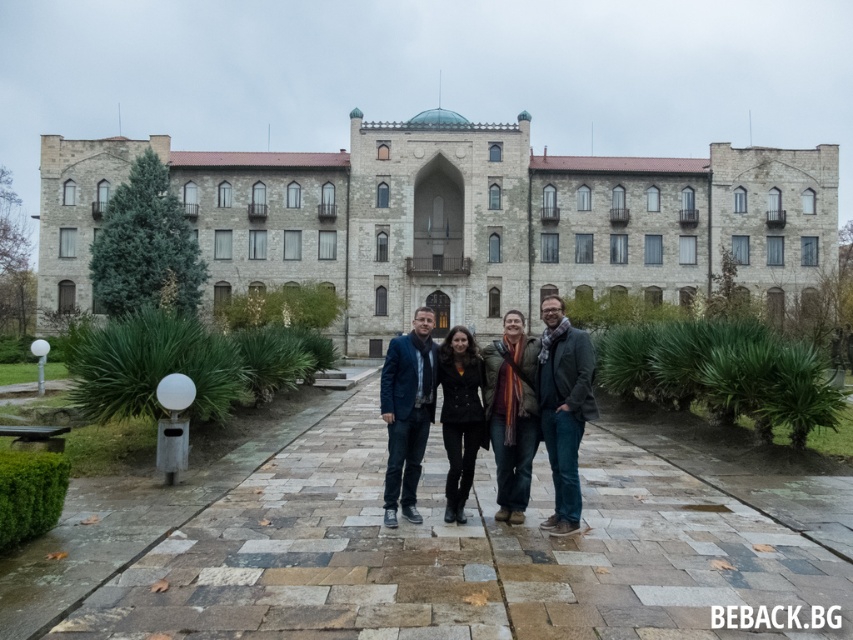
You are a fashion designer observing the group on the pathway in front of the historic building. You notice the dark gray wool scarf at center and the dark blue textured blazer at center. Which item of clothing is bigger in size?

The dark gray wool scarf at center is larger in size than the dark blue textured blazer at center.

You are a photographer trying to capture a photo of the group standing on the pathway in front of the historic building. You notice the dark gray wool scarf at center and the dark blue textured blazer at center. Which clothing item is positioned higher on the person wearing them?

The dark gray wool scarf at center is taller than the dark blue textured blazer at center, so the scarf is positioned higher on the person wearing them.

You are a photographer trying to capture a group photo of the four individuals standing on the pathway in front of the historic building. You notice the orange striped scarf at center and the dark blue textured blazer at center. Which clothing item would you focus on first to ensure it fits within the frame, considering their sizes?

The orange striped scarf at center has a larger width than the dark blue textured blazer at center, so you should focus on ensuring the orange striped scarf at center fits within the frame first to accommodate its size.